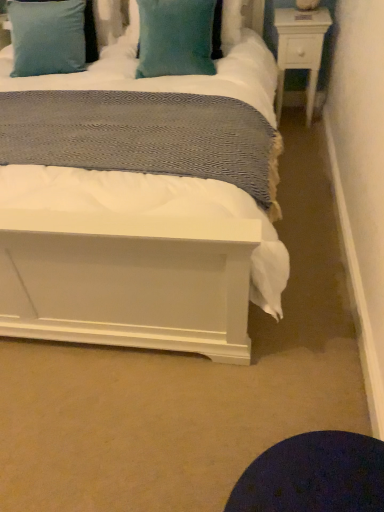
Question: Is white wood nightstand at upper right surrounding teal plush pillow at upper center, placed as the 2th pillow when sorted from left to right?

Choices:
 (A) no
 (B) yes

Answer: (A)

Question: Is white wood nightstand at upper right aimed at teal plush pillow at upper center, placed as the 2th pillow when sorted from left to right?

Choices:
 (A) yes
 (B) no

Answer: (B)

Question: Can you confirm if white wood nightstand at upper right is wider than teal plush pillow at upper center, placed as the 2th pillow when sorted from left to right?

Choices:
 (A) yes
 (B) no

Answer: (B)

Question: Considering the relative sizes of white wood nightstand at upper right and teal plush pillow at upper center, placed as the 2th pillow when sorted from left to right, in the image provided, is white wood nightstand at upper right taller than teal plush pillow at upper center, placed as the 2th pillow when sorted from left to right,?

Choices:
 (A) no
 (B) yes

Answer: (B)

Question: Does white wood nightstand at upper right have a smaller size compared to teal plush pillow at upper center, placed as the 2th pillow when sorted from left to right?

Choices:
 (A) no
 (B) yes

Answer: (B)

Question: From the image's perspective, relative to teal velvet pillow at upper center, which is the 1th pillow from left to right, is teal plush pillow at upper center, which ranks as the first pillow in right-to-left order, above or below?

Choices:
 (A) above
 (B) below

Answer: (B)

Question: In terms of width, does teal plush pillow at upper center, which ranks as the first pillow in right-to-left order, look wider or thinner when compared to teal velvet pillow at upper center, which is the 2th pillow from right to left?

Choices:
 (A) thin
 (B) wide

Answer: (B)

Question: From a real-world perspective, is teal plush pillow at upper center, placed as the 2th pillow when sorted from left to right, above or below teal velvet pillow at upper center, which is the 1th pillow from left to right?

Choices:
 (A) below
 (B) above

Answer: (A)

Question: Would you say teal plush pillow at upper center, which ranks as the first pillow in right-to-left order, is inside or outside teal velvet pillow at upper center, which is the 1th pillow from left to right?

Choices:
 (A) inside
 (B) outside

Answer: (B)

Question: Is teal plush pillow at upper center, placed as the 2th pillow when sorted from left to right, taller or shorter than white wood nightstand at upper right?

Choices:
 (A) tall
 (B) short

Answer: (B)

Question: Is teal plush pillow at upper center, placed as the 2th pillow when sorted from left to right, situated inside white wood nightstand at upper right or outside?

Choices:
 (A) inside
 (B) outside

Answer: (B)

Question: Is teal plush pillow at upper center, which ranks as the first pillow in right-to-left order, in front of or behind white wood nightstand at upper right in the image?

Choices:
 (A) behind
 (B) front

Answer: (B)

Question: Is point (152, 18) positioned closer to the camera than point (307, 53)?

Choices:
 (A) closer
 (B) farther

Answer: (A)

Question: From their relative heights in the image, would you say white wood nightstand at upper right is taller or shorter than teal plush pillow at upper center, which ranks as the first pillow in right-to-left order?

Choices:
 (A) short
 (B) tall

Answer: (B)

Question: Is white wood nightstand at upper right wider or thinner than teal plush pillow at upper center, which ranks as the first pillow in right-to-left order?

Choices:
 (A) thin
 (B) wide

Answer: (A)